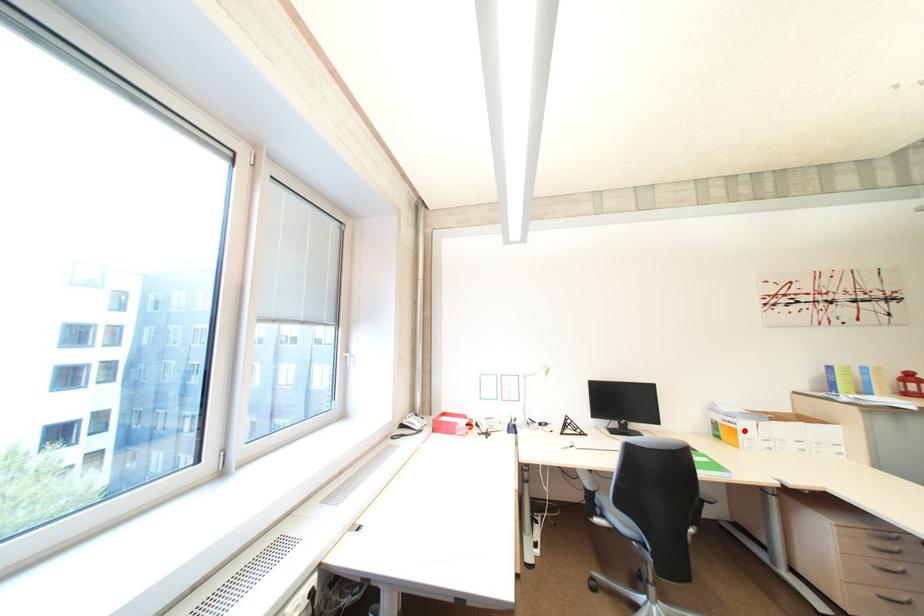
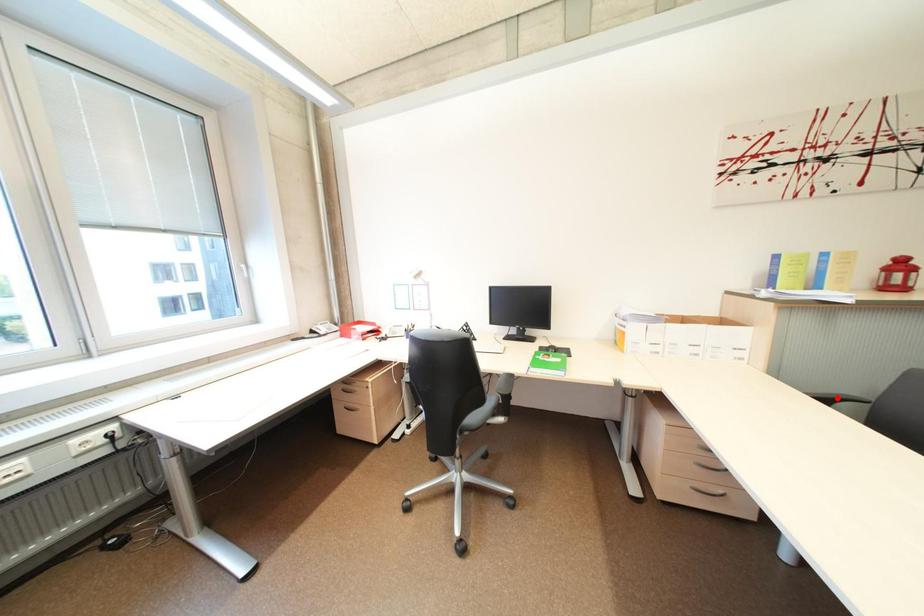
I am providing you with two images of the same scene from different viewpoints. A red point is marked on the first image and another point is marked on the second image. Does the point marked in image1 correspond to the same location as the one in image2?

No